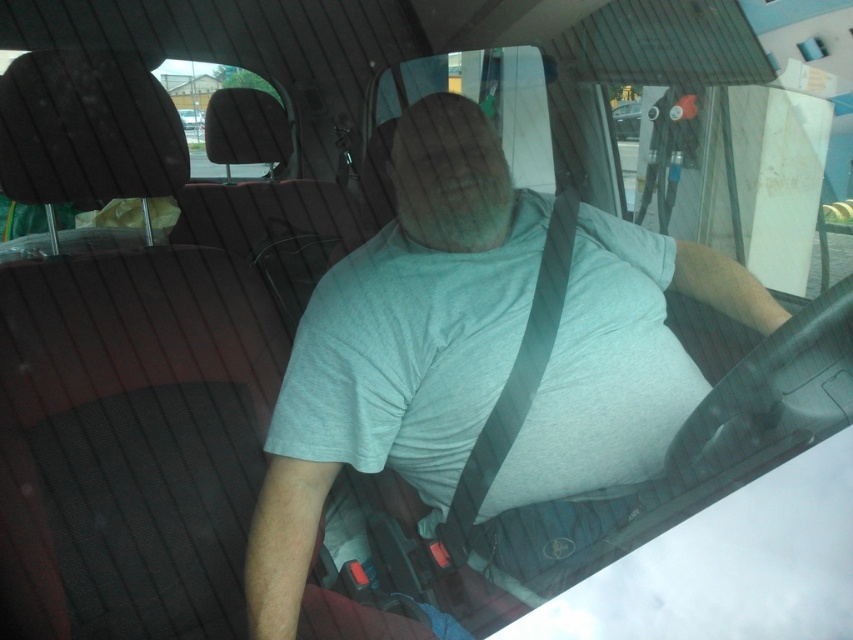
Question: Considering the real-world distances, which object is farthest from the metallic silver car at center?

Choices:
 (A) gray fabric seatbelt at center
 (B) transparent glass windshield at upper center

Answer: (A)

Question: Which object appears closest to the camera in this image?

Choices:
 (A) metallic silver car at center
 (B) gray matte t-shirt at center

Answer: (B)

Question: Does transparent glass windshield at upper center appear under gray fabric seatbelt at center?

Choices:
 (A) no
 (B) yes

Answer: (A)

Question: Is gray fabric seatbelt at center above metallic silver car at center?

Choices:
 (A) no
 (B) yes

Answer: (A)

Question: Is the position of gray matte t-shirt at center more distant than that of gray fabric seatbelt at center?

Choices:
 (A) no
 (B) yes

Answer: (A)

Question: Considering the real-world distances, which object is closest to the gray fabric seatbelt at center?

Choices:
 (A) metallic silver car at center
 (B) transparent glass windshield at upper center

Answer: (B)